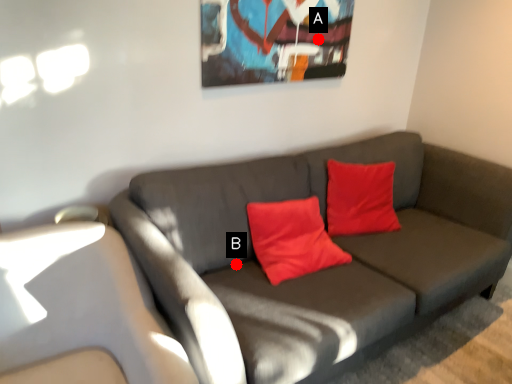
Question: Two points are circled on the image, labeled by A and B beside each circle. Which point is closer to the camera?

Choices:
 (A) A is closer
 (B) B is closer

Answer: (B)